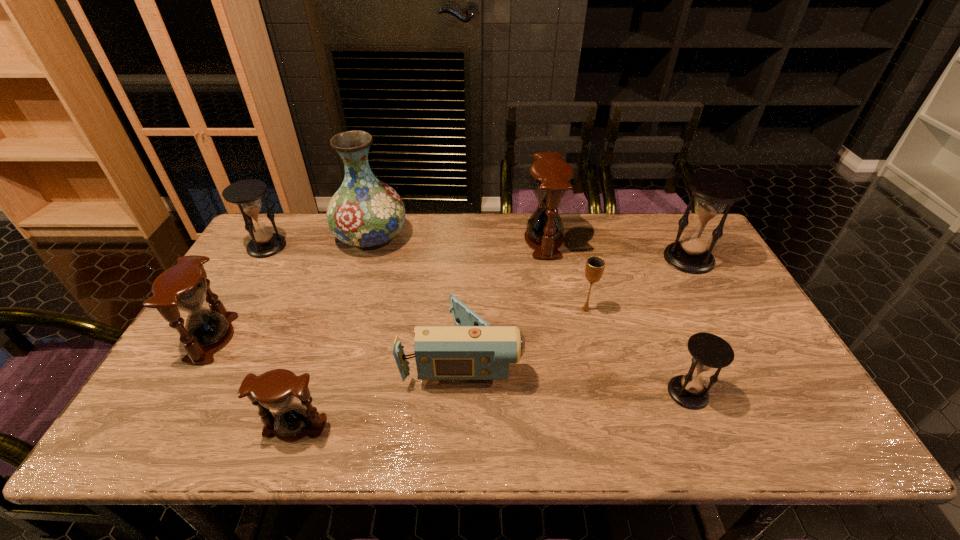
Locate an element on the screen. vacant space located 0.340m on the right of the chalice is located at coordinates (714, 309).

Identify the location of free point located on the side of the fifth object from right to left with the flip-out screen. The width and height of the screenshot is (960, 540). (605, 352).

Where is `vacant space located 0.190m on the back of the smallest black hourglass`? The width and height of the screenshot is (960, 540). vacant space located 0.190m on the back of the smallest black hourglass is located at coordinates (659, 319).

At what (x,y) coordinates should I click in order to perform the action: click on free spot located 0.220m on the left of the fourth hourglass from right to left. Please return your answer as a coordinate pair (x, y). The width and height of the screenshot is (960, 540). Looking at the image, I should click on (166, 426).

The image size is (960, 540). Find the location of `vase that is at the far edge`. vase that is at the far edge is located at coordinates (365, 212).

The image size is (960, 540). Identify the location of object that is at the near edge. (276, 389).

Where is `object located in the right edge section of the desktop`? object located in the right edge section of the desktop is located at coordinates (714, 190).

At what (x,y) coordinates should I click in order to perform the action: click on object located in the far left corner section of the desktop. Please return your answer as a coordinate pair (x, y). This screenshot has height=540, width=960. Looking at the image, I should click on (264, 243).

The height and width of the screenshot is (540, 960). Find the location of `object that is at the far right corner`. object that is at the far right corner is located at coordinates (714, 190).

The image size is (960, 540). I want to click on vacant space at the far edge, so click(511, 241).